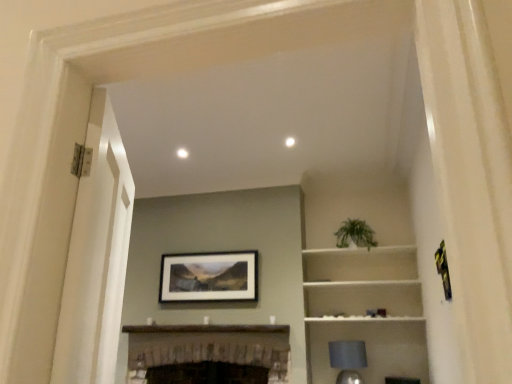
Question: Considering the relative positions of white matte cabinet at upper right and green leafy plant at upper center in the image provided, is white matte cabinet at upper right to the left of green leafy plant at upper center from the viewer's perspective?

Choices:
 (A) no
 (B) yes

Answer: (A)

Question: From a real-world perspective, is white matte cabinet at upper right under green leafy plant at upper center?

Choices:
 (A) no
 (B) yes

Answer: (B)

Question: Does white matte cabinet at upper right come behind green leafy plant at upper center?

Choices:
 (A) no
 (B) yes

Answer: (A)

Question: Could you tell me if white matte cabinet at upper right is facing green leafy plant at upper center?

Choices:
 (A) yes
 (B) no

Answer: (B)

Question: Is white matte cabinet at upper right to the right of green leafy plant at upper center from the viewer's perspective?

Choices:
 (A) no
 (B) yes

Answer: (B)

Question: Does white matte cabinet at upper right have a lesser width compared to green leafy plant at upper center?

Choices:
 (A) yes
 (B) no

Answer: (B)

Question: From the image's perspective, is green leafy plant at upper center under white matte cabinet at upper right?

Choices:
 (A) no
 (B) yes

Answer: (A)

Question: Can you confirm if green leafy plant at upper center is smaller than white matte cabinet at upper right?

Choices:
 (A) yes
 (B) no

Answer: (A)

Question: From a real-world perspective, is green leafy plant at upper center on top of white matte cabinet at upper right?

Choices:
 (A) yes
 (B) no

Answer: (A)

Question: Is green leafy plant at upper center far away from white matte cabinet at upper right?

Choices:
 (A) yes
 (B) no

Answer: (B)

Question: Is green leafy plant at upper center taller than white matte cabinet at upper right?

Choices:
 (A) no
 (B) yes

Answer: (A)

Question: Can we say green leafy plant at upper center lies outside white matte cabinet at upper right?

Choices:
 (A) yes
 (B) no

Answer: (A)

Question: Considering the relative positions of white matte cabinet at upper right and dark brown wood fireplace at center in the image provided, is white matte cabinet at upper right in front of dark brown wood fireplace at center?

Choices:
 (A) yes
 (B) no

Answer: (B)